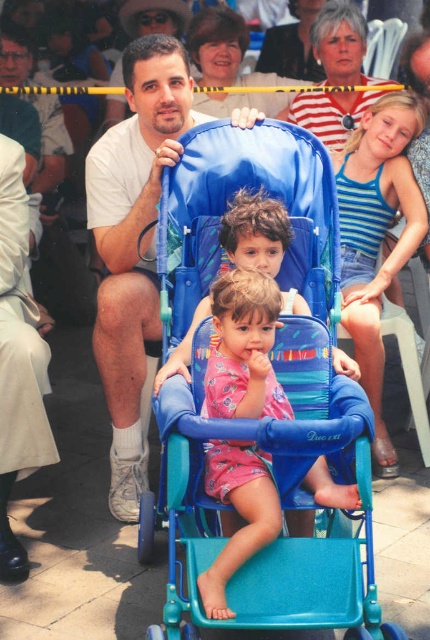
Question: Based on their relative distances, which object is nearer to the pink fabric baby at center?

Choices:
 (A) matte white shirt at upper left
 (B) blue fabric stroller at center

Answer: (B)

Question: Which point is farther from the camera taking this photo?

Choices:
 (A) (273, 400)
 (B) (159, 516)
 (C) (172, 42)

Answer: (C)

Question: Is matte white shirt at upper left positioned in front of pink fabric baby at center?

Choices:
 (A) yes
 (B) no

Answer: (B)

Question: Can you confirm if blue fabric stroller at center is wider than pink fabric baby at center?

Choices:
 (A) no
 (B) yes

Answer: (B)

Question: Estimate the real-world distances between objects in this image. Which object is farther from the blue fabric stroller at center?

Choices:
 (A) pink fabric baby at center
 (B) matte white shirt at upper left

Answer: (B)

Question: Can you confirm if blue fabric stroller at center is smaller than matte white shirt at upper left?

Choices:
 (A) no
 (B) yes

Answer: (A)